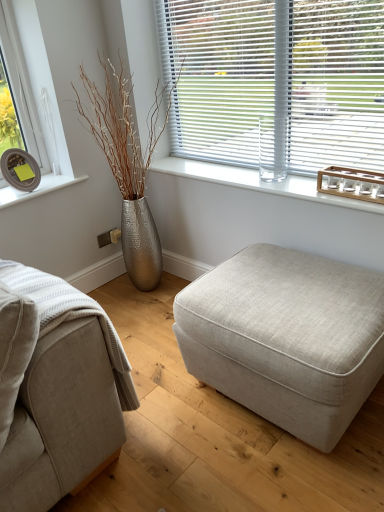
Locate an element on the screen. free space to the left of beige fabric ottoman at center is located at coordinates (161, 412).